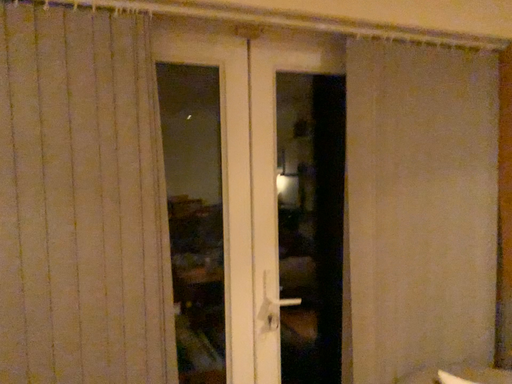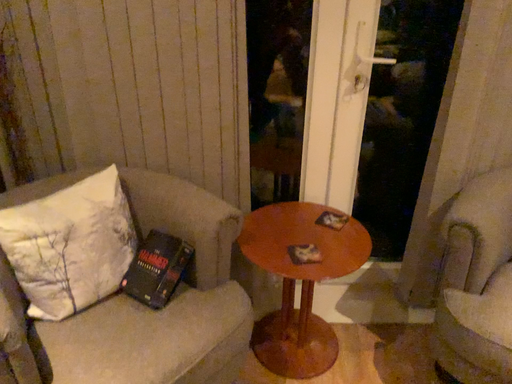
Question: Which way did the camera rotate in the video?

Choices:
 (A) rotated upward
 (B) rotated downward

Answer: (B)